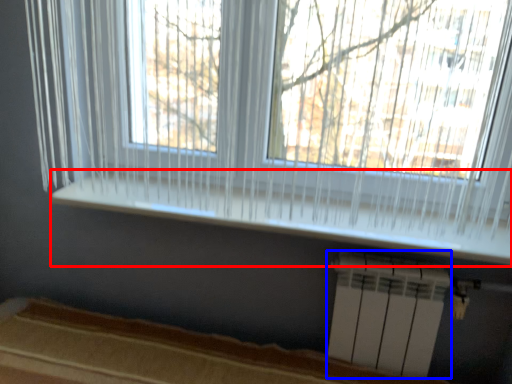
Question: Which object is closer to the camera taking this photo, window sill (highlighted by a red box) or air conditioning (highlighted by a blue box)?

Choices:
 (A) window sill
 (B) air conditioning

Answer: (A)